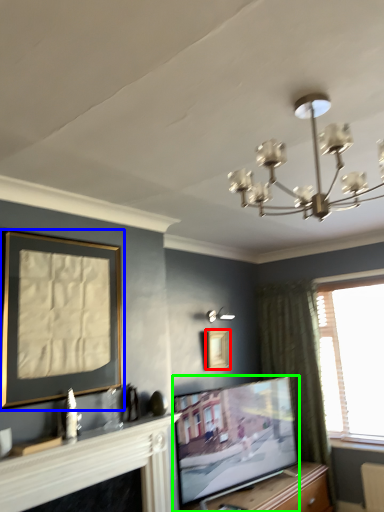
Question: Which object is positioned farthest from picture frame (highlighted by a red box)? Select from picture frame (highlighted by a blue box) and television (highlighted by a green box).

Choices:
 (A) picture frame
 (B) television

Answer: (A)